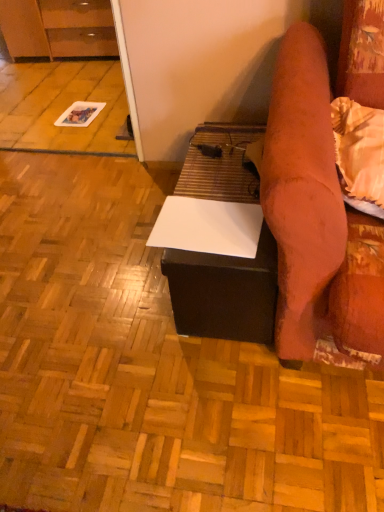
Where is `matte brown cabinet at upper left`? This screenshot has height=512, width=384. matte brown cabinet at upper left is located at coordinates (58, 28).

The width and height of the screenshot is (384, 512). Identify the location of white matte paper at center. (x=151, y=370).

Which object is more forward, matte brown cabinet at upper left or white matte paper at center?

white matte paper at center.

Would you say matte brown cabinet at upper left is inside or outside white matte paper at center?

The correct answer is: outside.

From the picture: Which is closer, (94, 33) or (164, 442)?

Point (164, 442)

From a real-world perspective, is matte brown cabinet at upper left under white matte paper at center?

Actually, matte brown cabinet at upper left is physically above white matte paper at center in the real world.

Which object is further away from the camera taking this photo, white matte paper at center or matte brown cabinet at upper left?

matte brown cabinet at upper left is more distant.

Where is `cabinetry lying above the white matte paper at center (from the image's perspective)`? This screenshot has height=512, width=384. cabinetry lying above the white matte paper at center (from the image's perspective) is located at coordinates (58, 28).

Is white matte paper at center completely or partially outside of matte brown cabinet at upper left?

Absolutely, white matte paper at center is external to matte brown cabinet at upper left.

Consider the image. From the image's perspective, relative to matte brown cabinet at upper left, is white matte paper at center above or below?

From the image's perspective, white matte paper at center appears below matte brown cabinet at upper left.

Between white matte table at center and matte brown cabinet at upper left, which one has smaller width?

With smaller width is matte brown cabinet at upper left.

How different are the orientations of white matte table at center and matte brown cabinet at upper left in degrees?

They differ by 1.22 degrees in their facing directions.

Does white matte table at center come behind matte brown cabinet at upper left?

No, the depth of white matte table at center is less than that of matte brown cabinet at upper left.

From the image's perspective, does white matte table at center appear higher than white matte paper at center?

Correct, white matte table at center appears higher than white matte paper at center in the image.

From a real-world perspective, is white matte table at center physically located above or below white matte paper at center?

Clearly, from a real-world perspective, white matte table at center is above white matte paper at center.

In the image, is white matte table at center positioned in front of or behind white matte paper at center?

In the image, white matte table at center appears behind white matte paper at center.

Is white matte paper at center located outside white matte table at center?

white matte paper at center is positioned outside white matte table at center.

In terms of height, does white matte paper at center look taller or shorter compared to white matte table at center?

white matte paper at center is shorter than white matte table at center.

Is white matte paper at center at the left side of white matte table at center?

Yes.

Which point is more distant from viewer, (55, 55) or (243, 186)?

The point (55, 55) is behind.

From a real-world perspective, which is physically below, matte brown cabinet at upper left or white matte table at center?

white matte table at center.

Based on the photo, how different are the orientations of matte brown cabinet at upper left and white matte table at center in degrees?

The angular difference between matte brown cabinet at upper left and white matte table at center is 1.22 degrees.

From the image's perspective, between matte brown cabinet at upper left and white matte table at center, which one is located above?

From the image's view, matte brown cabinet at upper left is above.

Image resolution: width=384 pixels, height=512 pixels. I want to click on cabinetry on the left of white matte paper at center, so click(58, 28).

Locate an element on the screen. This screenshot has height=512, width=384. plywood that appears below the matte brown cabinet at upper left (from the image's perspective) is located at coordinates (151, 370).

Which object lies further to the anchor point white matte paper at center, matte brown cabinet at upper left or white matte table at center?

matte brown cabinet at upper left is further to white matte paper at center.

Considering their positions, is matte brown cabinet at upper left positioned further to white matte table at center than white matte paper at center?

The object further to white matte table at center is matte brown cabinet at upper left.

When comparing their distances from matte brown cabinet at upper left, does white matte table at center or white matte paper at center seem closer?

white matte paper at center lies closer to matte brown cabinet at upper left than the other object.

Estimate the real-world distances between objects in this image. Which object is further from white matte paper at center, white matte table at center or matte brown cabinet at upper left?

matte brown cabinet at upper left is further to white matte paper at center.

Which object lies further to the anchor point matte brown cabinet at upper left, white matte paper at center or white matte table at center?

The object further to matte brown cabinet at upper left is white matte table at center.

Looking at the image, which one is located further to white matte table at center, white matte paper at center or matte brown cabinet at upper left?

matte brown cabinet at upper left is further to white matte table at center.

The height and width of the screenshot is (512, 384). Identify the location of table between white matte paper at center and matte brown cabinet at upper left along the z-axis. (224, 292).